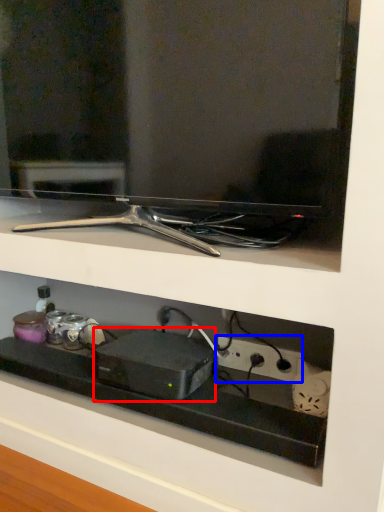
Question: Which object appears farthest to the camera in this image, appliance (highlighted by a red box) or electric outlet (highlighted by a blue box)?

Choices:
 (A) appliance
 (B) electric outlet

Answer: (B)